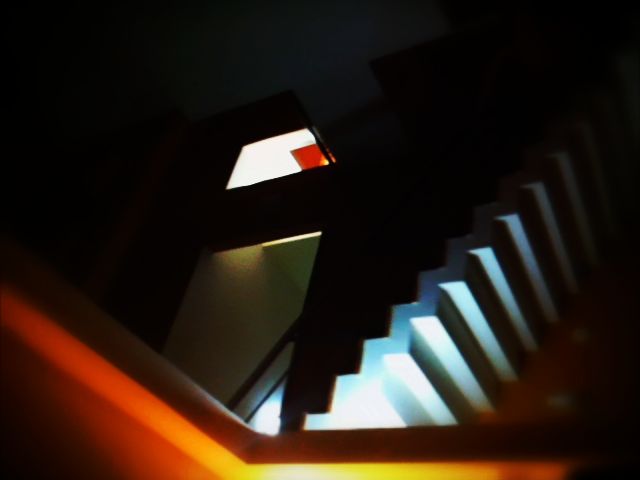
Image resolution: width=640 pixels, height=480 pixels. I want to click on blurred area of stairs, so pos(555,355).